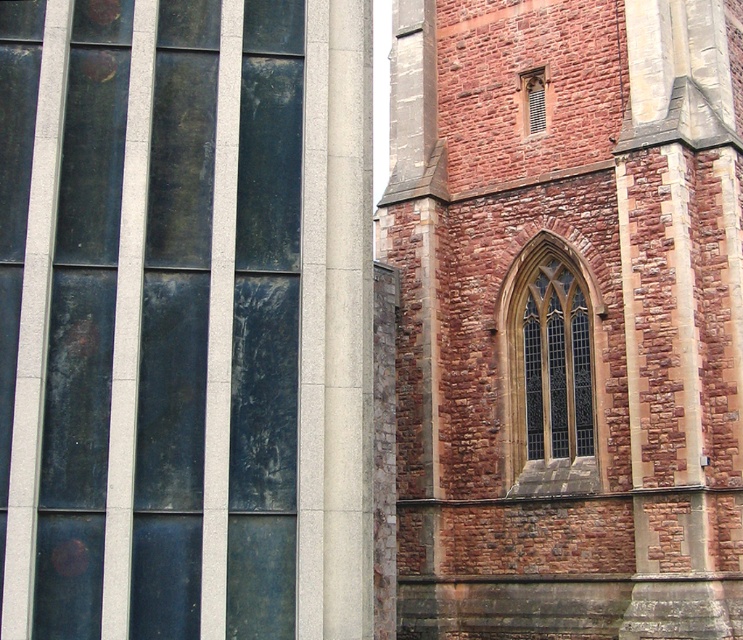
You are standing in front of the building and want to take a photo. There are two points marked on the image, point [426,381] and point [535,132]. Which point will appear larger in your photo?

Point [426,381] is closer to the camera than point [535,132], so it will appear larger in the photo.

Looking at this image, you are an architect examining the building facade. You need to determine the vertical arrangement of the stained glass window at center and the matte brick window at upper right. Which one is located higher up on the wall?

The stained glass window at center is positioned under the matte brick window at upper right, so the matte brick window at upper right is located higher up on the wall.